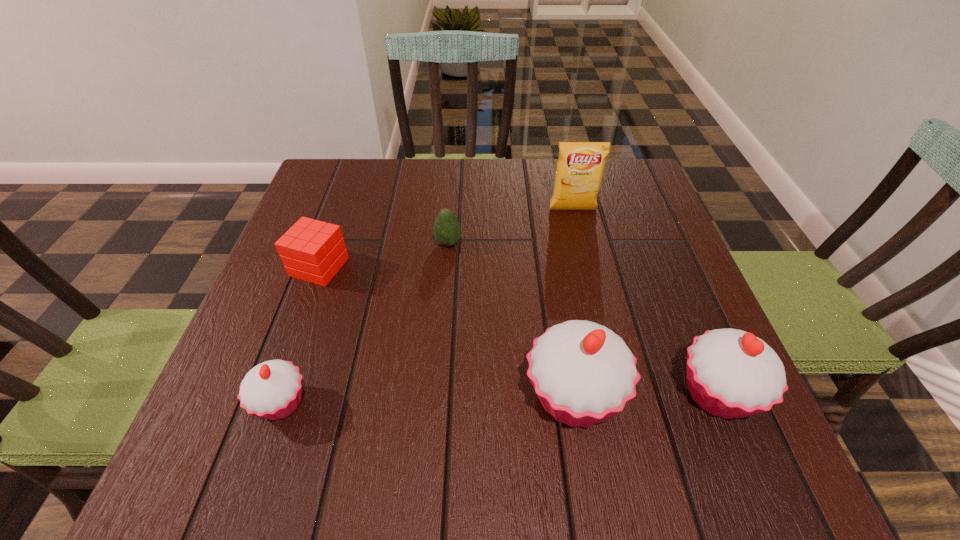
Identify the location of vacant space in between the shortest cupcake and the rightmost cupcake. The height and width of the screenshot is (540, 960). (499, 399).

The height and width of the screenshot is (540, 960). I want to click on free area in between the farthest object and the rightmost object, so click(x=645, y=302).

Find the location of a particular element. vacant space that's between the avocado and the cube is located at coordinates (384, 255).

I want to click on vacant space in between the cube and the third object from left to right, so click(384, 255).

At what (x,y) coordinates should I click in order to perform the action: click on free area in between the leftmost cupcake and the second cupcake from left to right. Please return your answer as a coordinate pair (x, y). The image size is (960, 540). Looking at the image, I should click on (427, 400).

Where is `empty space that is in between the leftmost cupcake and the cube`? empty space that is in between the leftmost cupcake and the cube is located at coordinates (300, 335).

Image resolution: width=960 pixels, height=540 pixels. Identify the location of object that ranks as the fifth closest to the shortest cupcake. (580, 167).

Select which object is the third closest to the second cupcake from right to left. Please provide its 2D coordinates. Your answer should be formatted as a tuple, i.e. [(x, y)], where the tuple contains the x and y coordinates of a point satisfying the conditions above.

[(272, 390)]

Image resolution: width=960 pixels, height=540 pixels. What are the coordinates of `cupcake that stands as the closest to the farthest object` in the screenshot? It's located at (583, 373).

Identify which cupcake is the closest to the second cupcake from right to left. Please provide its 2D coordinates. Your answer should be formatted as a tuple, i.e. [(x, y)], where the tuple contains the x and y coordinates of a point satisfying the conditions above.

[(731, 373)]